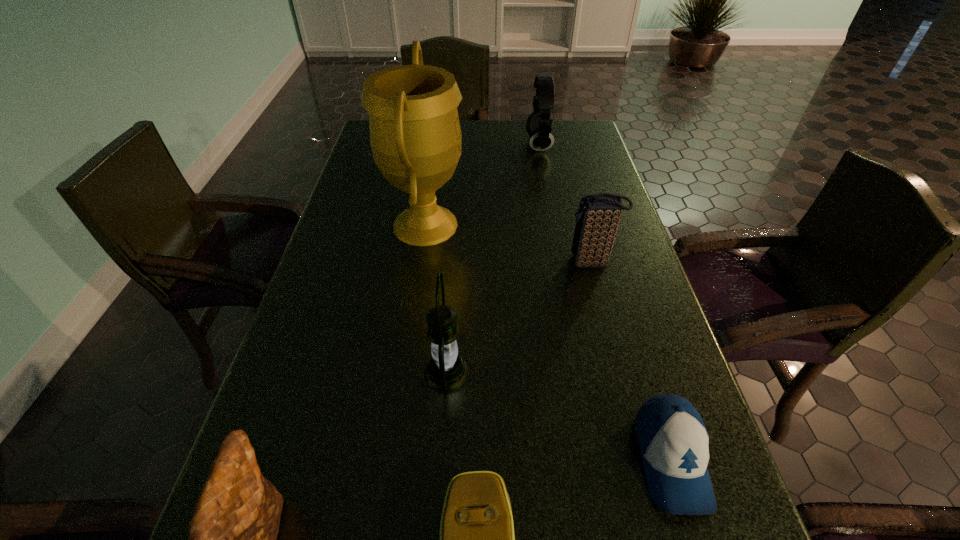
Locate an element on the screen. This screenshot has height=540, width=960. clutch bag that is the second closest to the farthest clutch bag is located at coordinates (233, 529).